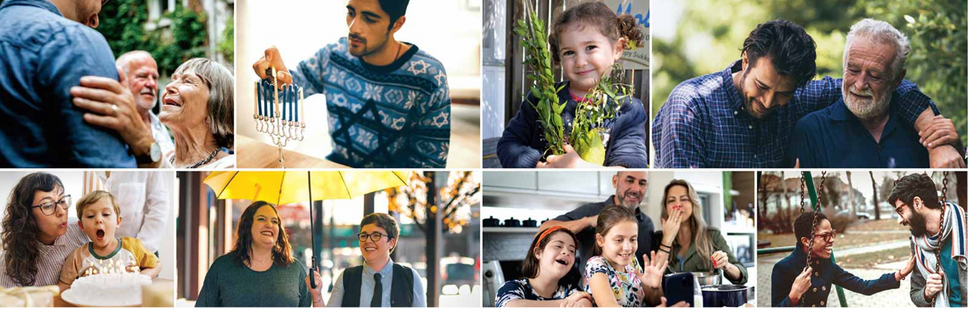
Locate an element on the screen. This screenshot has width=970, height=309. photos is located at coordinates pos(147,101), pos(351,101), pos(610,109), pos(709,104), pos(792,225), pos(654,245), pos(371,261), pos(124,255).